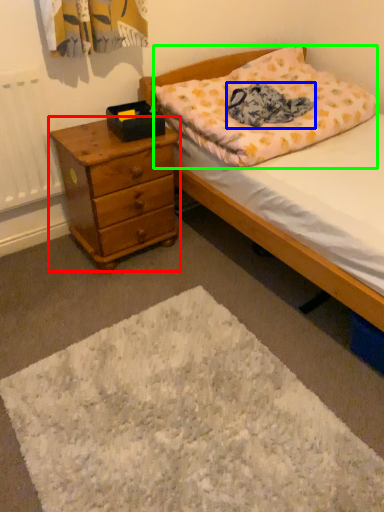
Question: Estimate the real-world distances between objects in this image. Which object is farther from chest of drawers (highlighted by a red box), blanket (highlighted by a blue box) or pillow (highlighted by a green box)?

Choices:
 (A) blanket
 (B) pillow

Answer: (A)